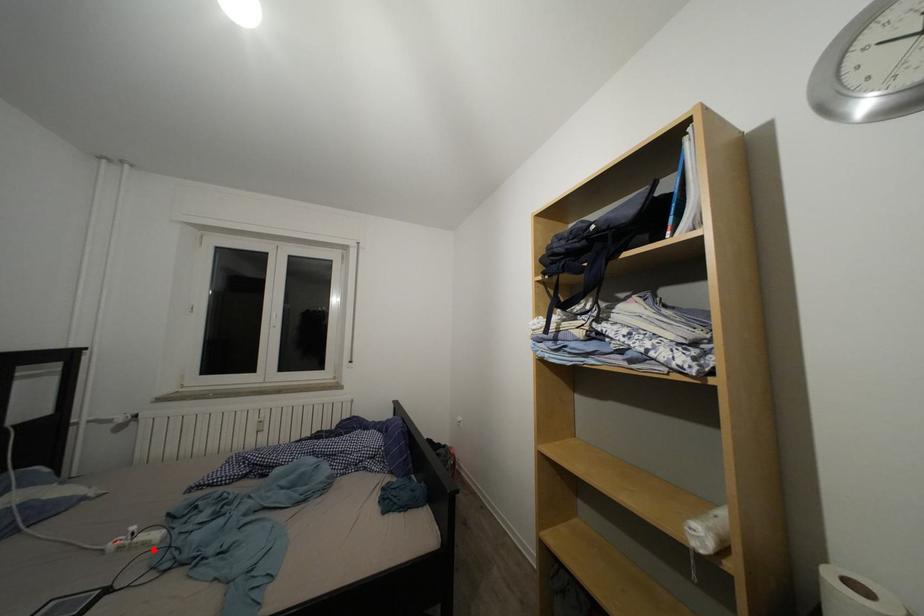
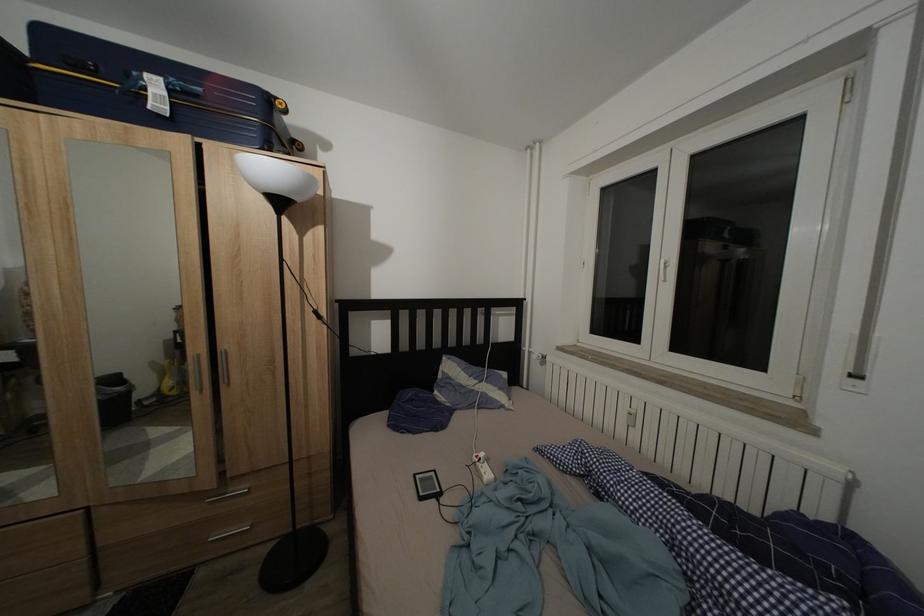
Where in the second image is the point corresponding to the highlighted location from the first image?

(488, 483)